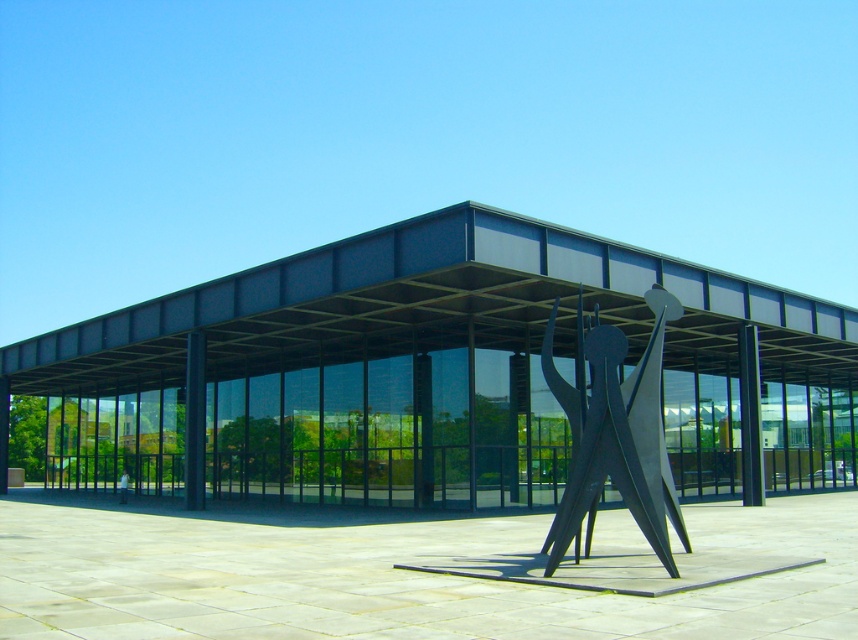
Which is more to the left, smooth concrete plaza at center or black metal canopy at center?

From the viewer's perspective, black metal canopy at center appears more on the left side.

Does point (204, 612) come behind point (583, 237)?

No.

Locate an element on the screen. The height and width of the screenshot is (640, 858). smooth concrete plaza at center is located at coordinates (433, 376).

From the picture: How distant is smooth concrete plaza at center from polished steel sculpture at center?

smooth concrete plaza at center and polished steel sculpture at center are 21.64 meters apart from each other.

Between smooth concrete plaza at center and polished steel sculpture at center, which one appears on the right side from the viewer's perspective?

polished steel sculpture at center

Is point (524, 618) more distant than point (653, 486)?

No, (524, 618) is closer to viewer.

This screenshot has width=858, height=640. In order to click on smooth concrete plaza at center in this screenshot , I will do `click(433, 376)`.

Can you confirm if black metal canopy at center is positioned below polished steel sculpture at center?

Yes.

From the picture: Is black metal canopy at center taller than polished steel sculpture at center?

Yes, black metal canopy at center is taller than polished steel sculpture at center.

Does point (240, 349) come in front of point (591, 456)?

No, it is behind (591, 456).

This screenshot has width=858, height=640. In order to click on black metal canopy at center in this screenshot , I will do `click(430, 307)`.